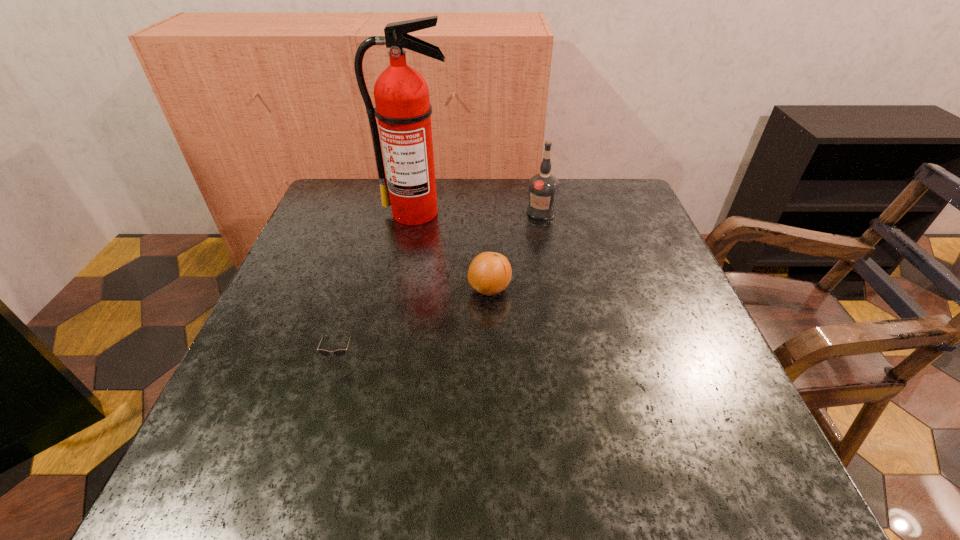
The image size is (960, 540). In order to click on vacant region at the near right corner in this screenshot , I will do `click(720, 450)`.

Identify the location of vacant space that is in between the second shortest object and the second tallest object. (516, 251).

At what (x,y) coordinates should I click in order to perform the action: click on free space between the nearest object and the third farthest object. Please return your answer as a coordinate pair (x, y). Image resolution: width=960 pixels, height=540 pixels. Looking at the image, I should click on click(415, 323).

Identify the location of vacant space that's between the sunglasses and the second nearest object. (415, 323).

Identify the location of vacant space in between the rightmost object and the sunglasses. (441, 285).

Find the location of a particular element. free spot between the second object from right to left and the shortest object is located at coordinates (415, 323).

The height and width of the screenshot is (540, 960). In order to click on free space between the second object from right to left and the nearest object in this screenshot , I will do `click(415, 323)`.

Find the location of a particular element. vacant region between the vodka and the tallest object is located at coordinates (478, 212).

Locate an element on the screen. vacant area that lies between the rightmost object and the sunglasses is located at coordinates (441, 285).

At what (x,y) coordinates should I click in order to perform the action: click on vacant space that's between the third farthest object and the fire extinguisher. Please return your answer as a coordinate pair (x, y). The image size is (960, 540). Looking at the image, I should click on (453, 251).